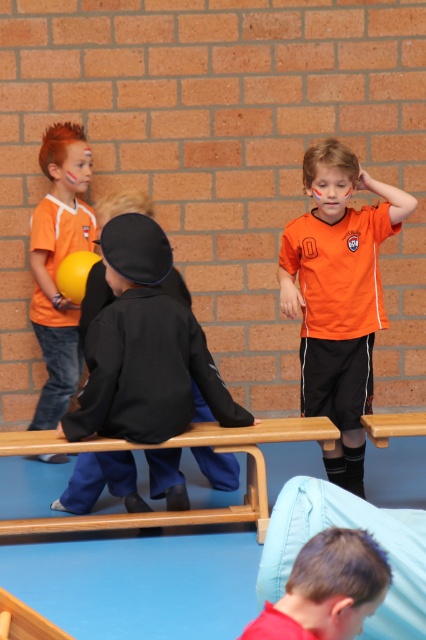
Question: Which point is farther to the camera?

Choices:
 (A) red matte shirt at lower center
 (B) black matte uniform at center
 (C) matte orange shirt at left
 (D) orange matte jersey at center

Answer: (C)

Question: Based on their relative distances, which object is farther from the black matte uniform at center?

Choices:
 (A) red matte shirt at lower center
 (B) matte orange shirt at left
 (C) orange matte jersey at center

Answer: (A)

Question: Can you confirm if black matte uniform at center is positioned below red matte shirt at lower center?

Choices:
 (A) yes
 (B) no

Answer: (B)

Question: Which is farther from the matte orange shirt at left?

Choices:
 (A) black matte uniform at center
 (B) orange matte jersey at center

Answer: (B)

Question: From the image, what is the correct spatial relationship of black matte uniform at center in relation to orange matte jersey at center?

Choices:
 (A) left
 (B) right

Answer: (A)

Question: Is matte orange shirt at left positioned at the back of red matte shirt at lower center?

Choices:
 (A) yes
 (B) no

Answer: (A)